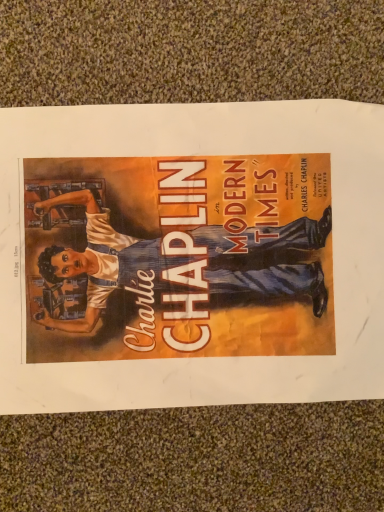
Where is `empty space that is ontop of matte paper poster at center (from a real-world perspective)`? empty space that is ontop of matte paper poster at center (from a real-world perspective) is located at coordinates (188, 256).